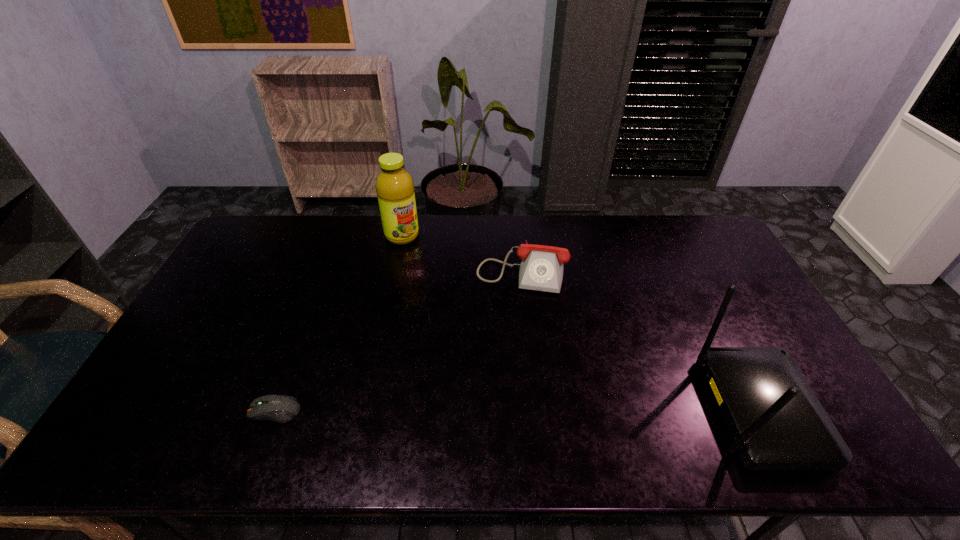
Where is `the leftmost object`? the leftmost object is located at coordinates (278, 408).

You are a GUI agent. You are given a task and a screenshot of the screen. Output one action in this format:
    pyautogui.click(x=<x>, y=<y>)
    Task: Click on the shortest object
    The height and width of the screenshot is (540, 960).
    Given the screenshot: What is the action you would take?
    pyautogui.click(x=278, y=408)

Locate an element on the screen. the rightmost object is located at coordinates (777, 423).

Find the location of a particular element. The image size is (960, 540). the second shortest object is located at coordinates (541, 269).

In order to click on the second object from right to left in this screenshot , I will do `click(541, 269)`.

Find the location of `fruit juice`. fruit juice is located at coordinates (394, 185).

Locate an element on the screen. Image resolution: width=960 pixels, height=540 pixels. vacant space situated on the button of the leftmost object is located at coordinates (133, 411).

The height and width of the screenshot is (540, 960). What are the coordinates of `vacant region located 0.130m on the button of the leftmost object` in the screenshot? It's located at (198, 411).

Where is `vacant space positioned on the button of the leftmost object`? Image resolution: width=960 pixels, height=540 pixels. vacant space positioned on the button of the leftmost object is located at coordinates (178, 411).

This screenshot has height=540, width=960. Identify the location of free space located on the dial of the third object from left to right. (508, 342).